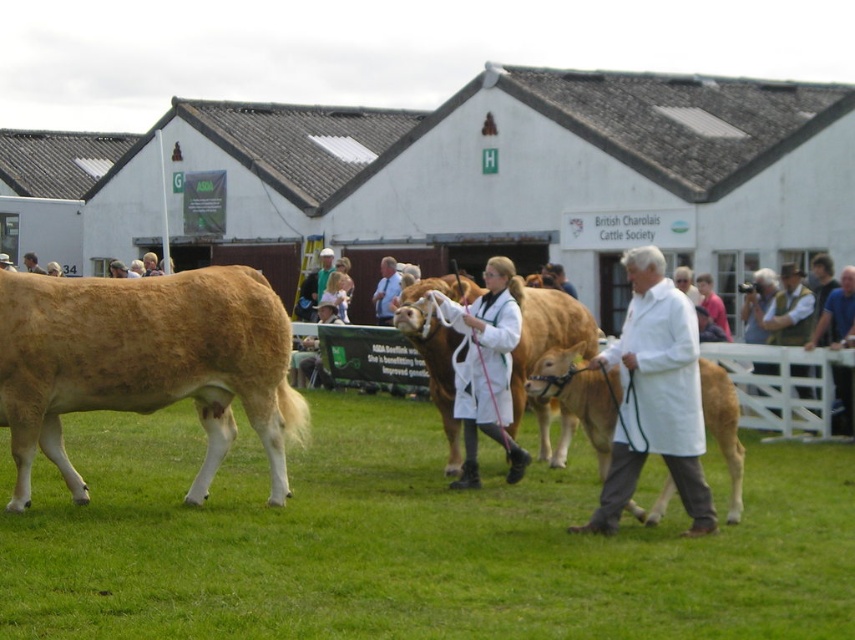
Question: Which point is farther to the camera?

Choices:
 (A) light brown leather jacket at center
 (B) white lab coat at center

Answer: (A)

Question: Is white lab coat at center positioned behind light brown leather jacket at center?

Choices:
 (A) yes
 (B) no

Answer: (B)

Question: Estimate the real-world distances between objects in this image. Which object is farther from the golden brown leather cow at center?

Choices:
 (A) golden brown cow at center
 (B) light brown leather jacket at center

Answer: (B)

Question: Is green grass at center to the right of golden brown cow at center from the viewer's perspective?

Choices:
 (A) no
 (B) yes

Answer: (B)

Question: Does green grass at center appear over golden brown leather cow at center?

Choices:
 (A) no
 (B) yes

Answer: (A)

Question: Which object is farther from the camera taking this photo?

Choices:
 (A) golden brown leather cow at center
 (B) white lab coat at center
 (C) golden brown cow at center

Answer: (C)